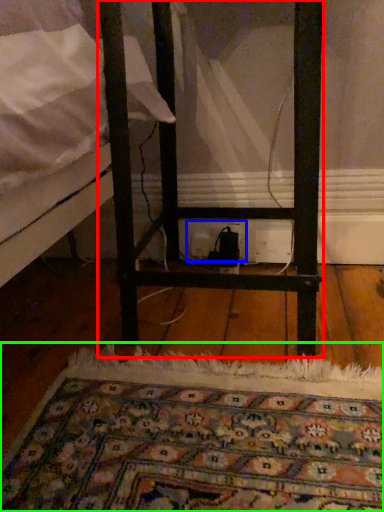
Question: Based on their relative distances, which object is nearer to furniture (highlighted by a red box)? Choose from electric outlet (highlighted by a blue box) and mat (highlighted by a green box).

Choices:
 (A) electric outlet
 (B) mat

Answer: (B)